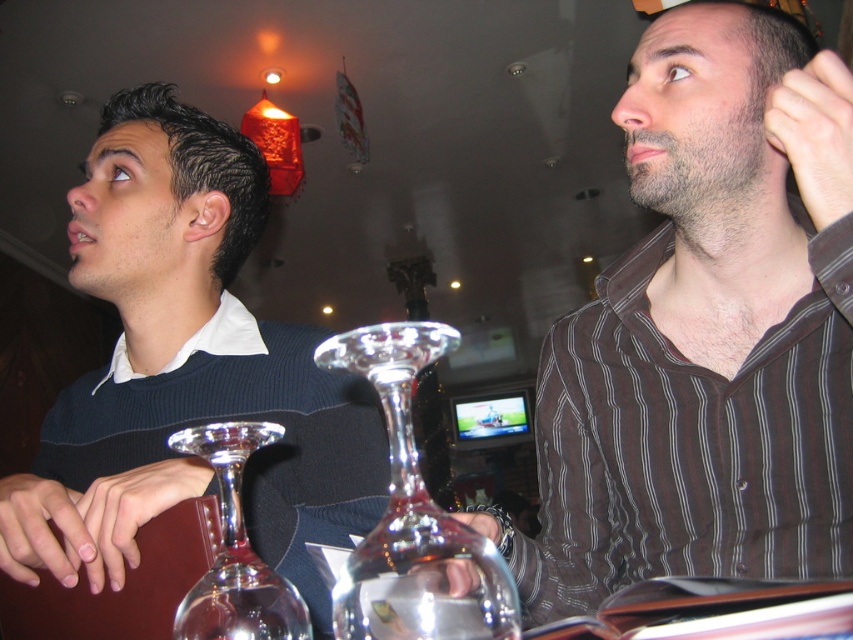
Is clear glass wine glass at center to the right of transparent glass wine glass at center from the viewer's perspective?

Yes, clear glass wine glass at center is to the right of transparent glass wine glass at center.

The width and height of the screenshot is (853, 640). What do you see at coordinates (413, 515) in the screenshot? I see `clear glass wine glass at center` at bounding box center [413, 515].

The width and height of the screenshot is (853, 640). Describe the element at coordinates (413, 515) in the screenshot. I see `clear glass wine glass at center` at that location.

Identify the location of clear glass wine glass at center. This screenshot has width=853, height=640. (413, 515).

Does brown striped shirt at upper right have a larger size compared to matte black sweater at left?

Actually, brown striped shirt at upper right might be smaller than matte black sweater at left.

Can you confirm if brown striped shirt at upper right is positioned to the left of matte black sweater at left?

Incorrect, brown striped shirt at upper right is not on the left side of matte black sweater at left.

Who is more forward, (683, 452) or (132, 148)?

Point (683, 452) is more forward.

At what (x,y) coordinates should I click in order to perform the action: click on brown striped shirt at upper right. Please return your answer as a coordinate pair (x, y). Image resolution: width=853 pixels, height=640 pixels. Looking at the image, I should click on (706, 332).

What are the coordinates of `matte black sweater at left` in the screenshot? It's located at (184, 365).

Can you confirm if matte black sweater at left is positioned to the left of clear glass wine glass at center?

Yes, matte black sweater at left is to the left of clear glass wine glass at center.

Find the location of a particular element. This screenshot has width=853, height=640. matte black sweater at left is located at coordinates (184, 365).